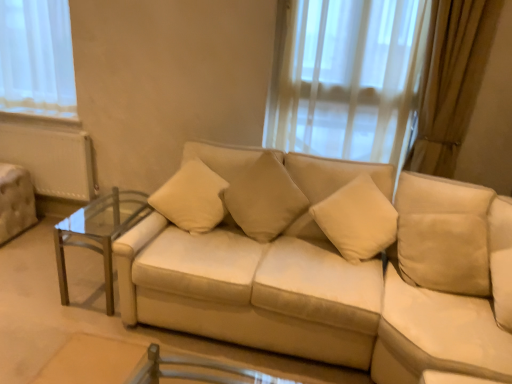
Question: Does beige fabric pillow at center, marked as the 2th pillow in a left-to-right arrangement, appear on the right side of clear glass table at left?

Choices:
 (A) no
 (B) yes

Answer: (B)

Question: From the image's perspective, is beige fabric pillow at center, marked as the 2th pillow in a left-to-right arrangement, under clear glass table at left?

Choices:
 (A) no
 (B) yes

Answer: (A)

Question: Is beige fabric pillow at center, marked as the 2th pillow in a left-to-right arrangement, placed right next to clear glass table at left?

Choices:
 (A) no
 (B) yes

Answer: (A)

Question: Can you confirm if beige fabric pillow at center, placed as the 1th pillow when sorted from right to left, is bigger than clear glass table at left?

Choices:
 (A) yes
 (B) no

Answer: (B)

Question: Can clear glass table at left be found inside beige fabric pillow at center, placed as the 1th pillow when sorted from right to left?

Choices:
 (A) no
 (B) yes

Answer: (A)

Question: Does beige fabric pillow at center, marked as the 2th pillow in a left-to-right arrangement, have a greater height compared to clear glass table at left?

Choices:
 (A) no
 (B) yes

Answer: (B)

Question: Considering the relative positions of beige suede couch at center and beige fabric pillow at center, the 2th pillow in the right-to-left sequence, in the image provided, is beige suede couch at center in front of beige fabric pillow at center, the 2th pillow in the right-to-left sequence,?

Choices:
 (A) no
 (B) yes

Answer: (B)

Question: Can you confirm if beige suede couch at center is wider than beige fabric pillow at center, the 1th pillow from the left?

Choices:
 (A) no
 (B) yes

Answer: (B)

Question: Is beige suede couch at center at the left side of beige fabric pillow at center, the 2th pillow in the right-to-left sequence?

Choices:
 (A) no
 (B) yes

Answer: (A)

Question: Is beige fabric pillow at center, the 1th pillow from the left, surrounded by beige suede couch at center?

Choices:
 (A) yes
 (B) no

Answer: (A)

Question: Is beige suede couch at center far away from beige fabric pillow at center, the 1th pillow from the left?

Choices:
 (A) no
 (B) yes

Answer: (A)

Question: Can you confirm if beige suede couch at center is smaller than beige fabric pillow at center, the 1th pillow from the left?

Choices:
 (A) no
 (B) yes

Answer: (A)

Question: Is beige fabric pillow at center, the 1th pillow from the left, positioned beyond the bounds of beige fabric pillow at center, placed as the 1th pillow when sorted from right to left?

Choices:
 (A) yes
 (B) no

Answer: (A)